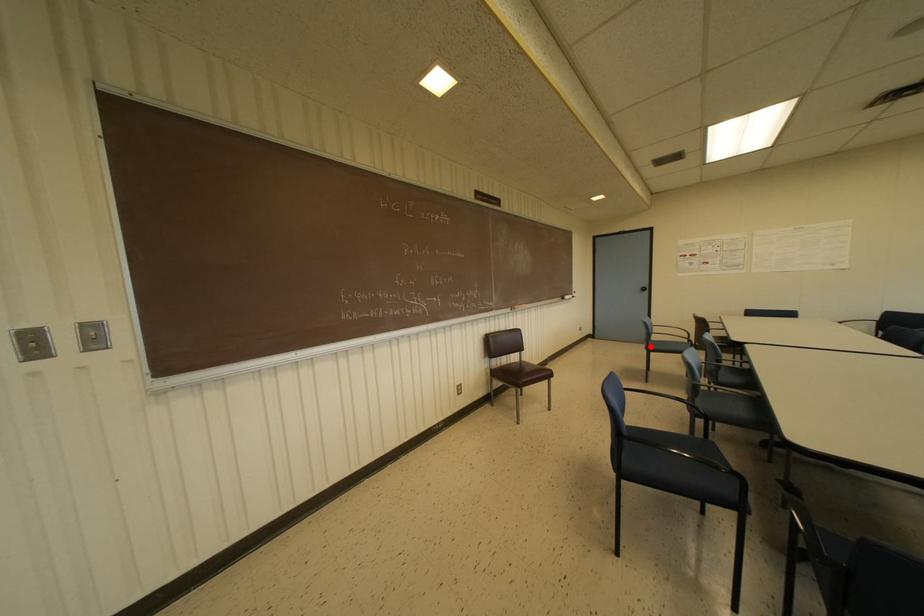
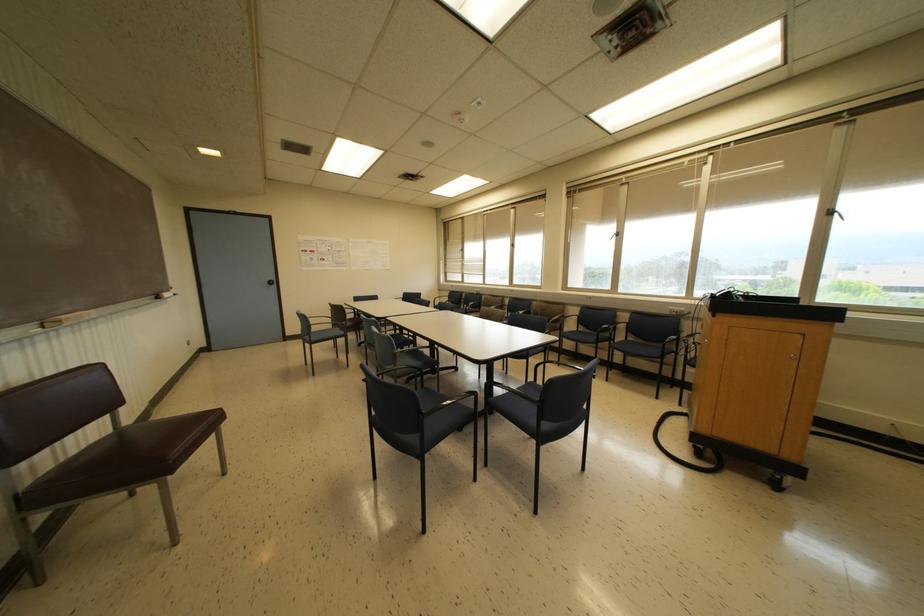
Find the pixel in the second image that matches the highlighted location in the first image.

(312, 338)